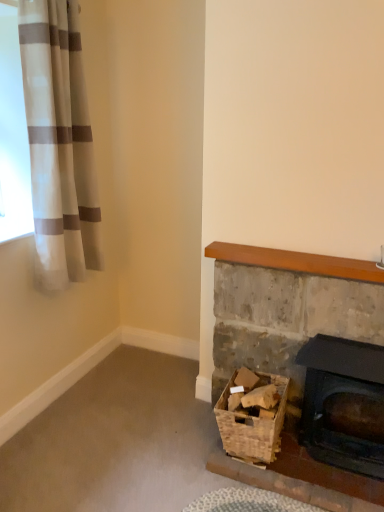
Locate an element on the screen. free point to the left of rustic stone fireplace at lower right, which is the 1th fireplace from left to right is located at coordinates (171, 451).